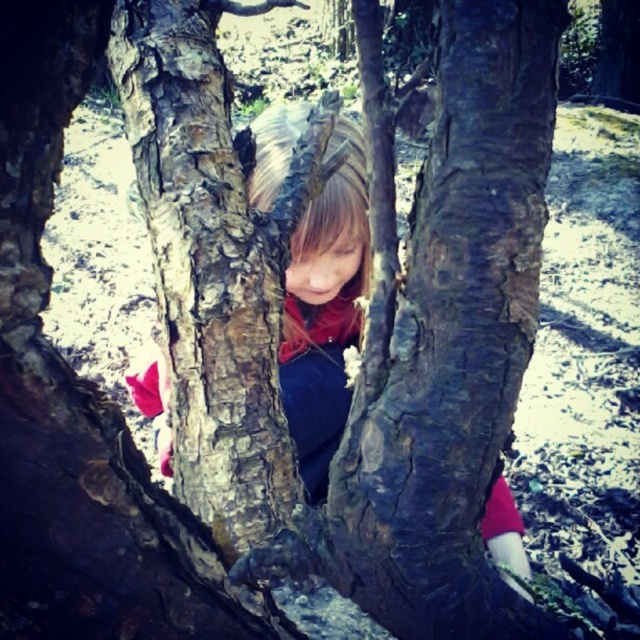
Is smooth bark tree trunk at center in front of matte red shirt at center?

Yes, it is in front of matte red shirt at center.

Can you confirm if smooth bark tree trunk at center is positioned above matte red shirt at center?

Yes, smooth bark tree trunk at center is above matte red shirt at center.

Where is `smooth bark tree trunk at center`? This screenshot has height=640, width=640. smooth bark tree trunk at center is located at coordinates (205, 268).